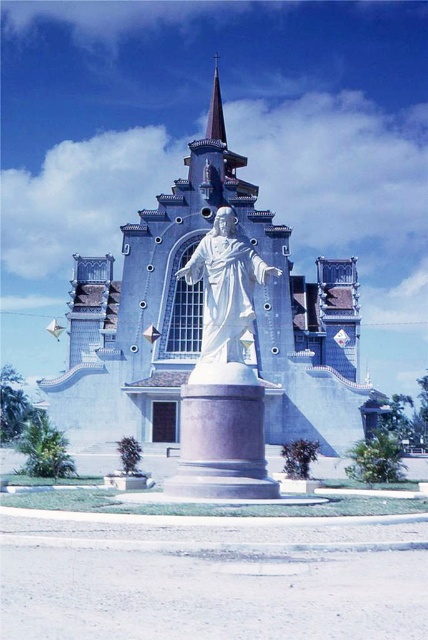
You are a visitor approaching the grand church and notice the white polished stone pedestal at center and the purple glass spire at upper center. Which object would you see first as you walk towards the church entrance?

The white polished stone pedestal at center is in front of the purple glass spire at upper center, so you would see it first as you approach the church entrance.

You are an artist planning to paint the church scene. You want to ensure the proportions between the white polished stone pedestal at center and the purple glass spire at upper center are accurate. Which object should you depict as bigger in your painting?

The white polished stone pedestal at center should be depicted as bigger in your painting since it is larger in size than the purple glass spire at upper center according to the description.

You are standing at the entrance of the grand church with a light blue exterior and a tall spire. You notice a point marked at coordinates (225, 298). What object is located at this point?

The point at coordinates (225, 298) indicates the location of the white marble statue at center.